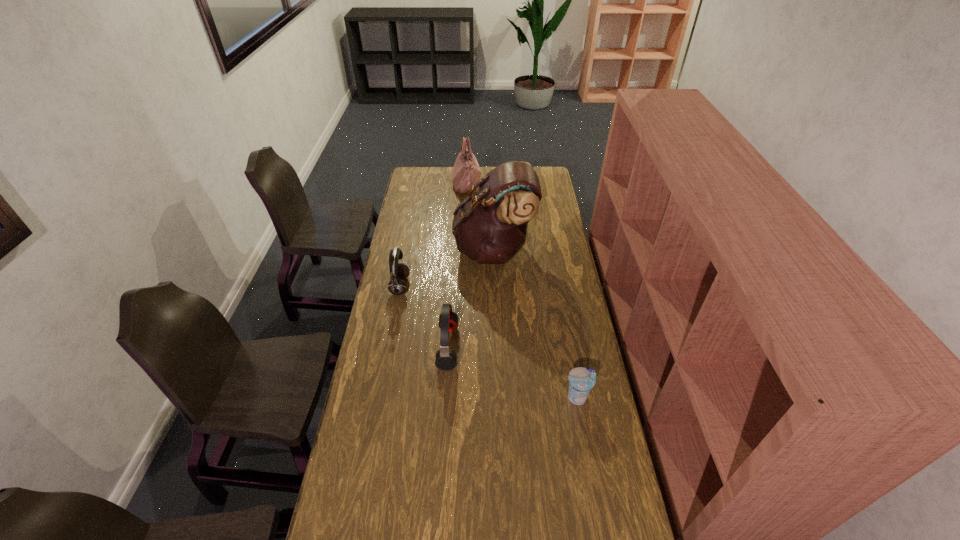
The height and width of the screenshot is (540, 960). In order to click on satchel in this screenshot , I will do `click(490, 227)`.

Where is `the fourth shortest object`? the fourth shortest object is located at coordinates (x=466, y=172).

This screenshot has width=960, height=540. I want to click on the farthest object, so click(x=466, y=172).

Locate an element on the screen. The width and height of the screenshot is (960, 540). the farther earphone is located at coordinates (398, 271).

I want to click on the leftmost object, so click(x=398, y=271).

You are a GUI agent. You are given a task and a screenshot of the screen. Output one action in this format:
    pyautogui.click(x=<x>, y=<y>)
    Task: Click on the right earphone
    
    Given the screenshot: What is the action you would take?
    pyautogui.click(x=445, y=359)

You are a GUI agent. You are given a task and a screenshot of the screen. Output one action in this format:
    pyautogui.click(x=<x>, y=<y>)
    Task: Click on the second shortest object
    The height and width of the screenshot is (540, 960).
    Given the screenshot: What is the action you would take?
    pyautogui.click(x=445, y=359)

Find the location of a particular element. The height and width of the screenshot is (540, 960). the rightmost object is located at coordinates (581, 380).

Image resolution: width=960 pixels, height=540 pixels. In order to click on yogurt in this screenshot , I will do `click(581, 380)`.

Identify the location of free space located at the front of the satchel with buckles. (391, 249).